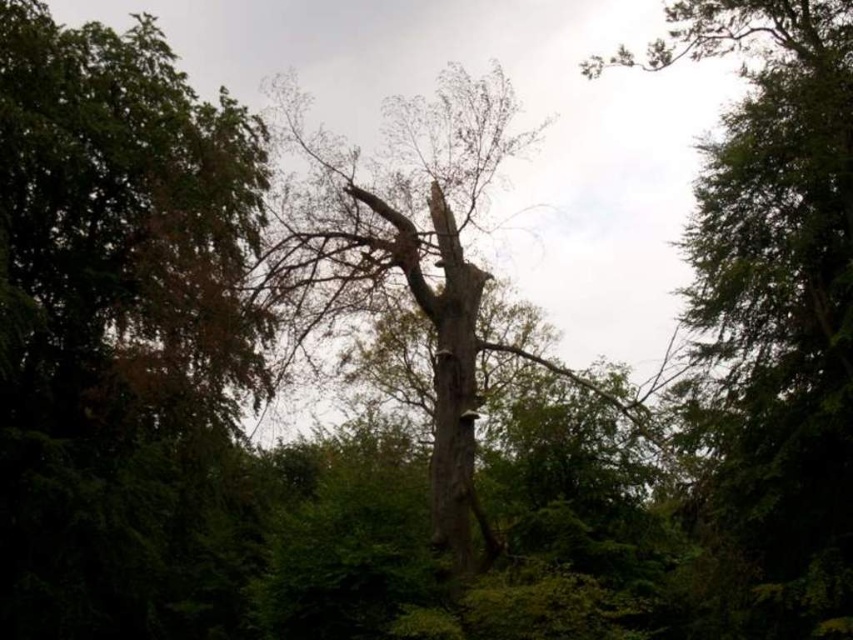
Is green leafy tree at upper center bigger than smooth bark tree at center?

Correct, green leafy tree at upper center is larger in size than smooth bark tree at center.

Who is positioned more to the right, green leafy tree at upper center or smooth bark tree at center?

From the viewer's perspective, green leafy tree at upper center appears more on the right side.

Is point (799, 353) closer to camera compared to point (325, 282)?

No, (799, 353) is behind (325, 282).

Image resolution: width=853 pixels, height=640 pixels. Find the location of `green leafy tree at upper center`. green leafy tree at upper center is located at coordinates (776, 298).

Does green leafy tree at left lie behind grayish-brown bark tree trunk at center?

That is True.

Which is more to the right, green leafy tree at left or grayish-brown bark tree trunk at center?

Positioned to the right is grayish-brown bark tree trunk at center.

This screenshot has width=853, height=640. In order to click on green leafy tree at left in this screenshot , I will do `click(113, 317)`.

Can you confirm if smooth bark tree at center is wider than grayish-brown bark tree trunk at center?

In fact, smooth bark tree at center might be narrower than grayish-brown bark tree trunk at center.

Does smooth bark tree at center have a smaller size compared to grayish-brown bark tree trunk at center?

Yes.

Is point (409, 182) closer to viewer compared to point (433, 182)?

Yes, point (409, 182) is in front of point (433, 182).

The width and height of the screenshot is (853, 640). What are the coordinates of `smooth bark tree at center` in the screenshot? It's located at [412, 262].